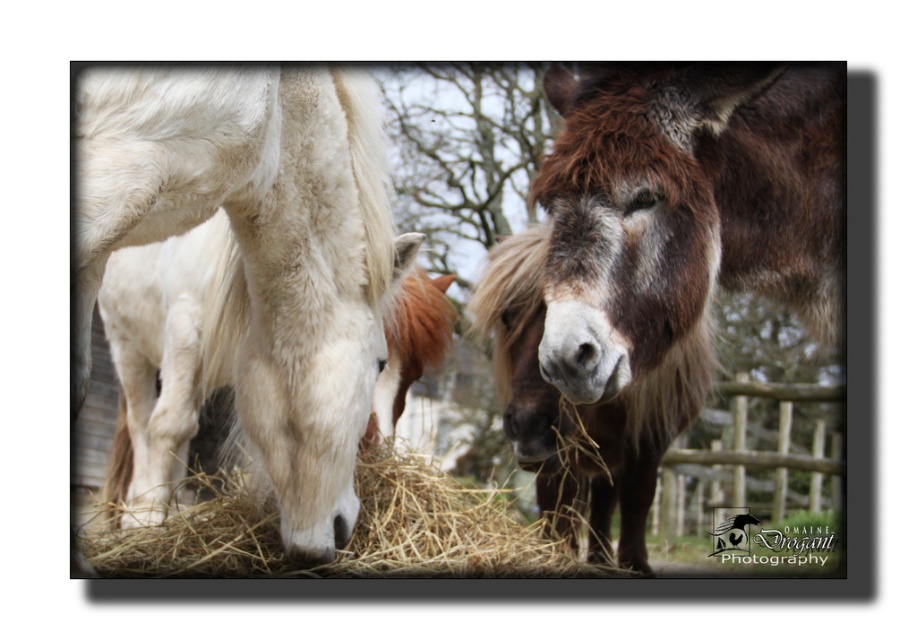
Question: Is brown fuzzy mule at center below white fluffy horse at left?

Choices:
 (A) yes
 (B) no

Answer: (A)

Question: Which of the following is the closest to the observer?

Choices:
 (A) (554, 161)
 (B) (284, 557)
 (C) (109, 99)

Answer: (C)

Question: Which object is positioned closest to the golden straw at center?

Choices:
 (A) white fluffy horse at left
 (B) brown fuzzy mule at center

Answer: (A)

Question: Can you confirm if brown fuzzy mule at center is smaller than golden straw at center?

Choices:
 (A) no
 (B) yes

Answer: (A)

Question: Estimate the real-world distances between objects in this image. Which object is closer to the golden straw at center?

Choices:
 (A) brown fuzzy mule at center
 (B) white fluffy horse at left

Answer: (B)

Question: Can you confirm if white fluffy horse at left is thinner than golden straw at center?

Choices:
 (A) no
 (B) yes

Answer: (B)